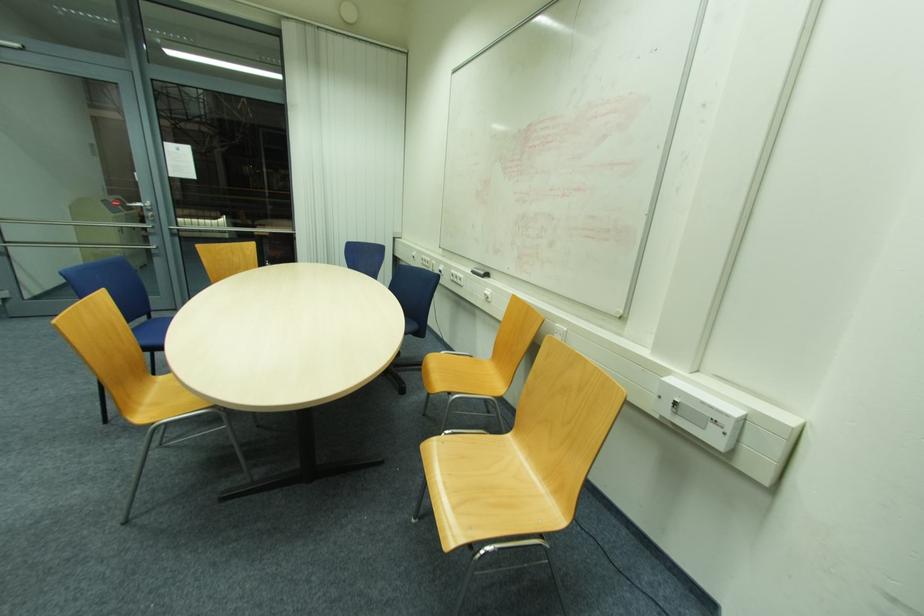
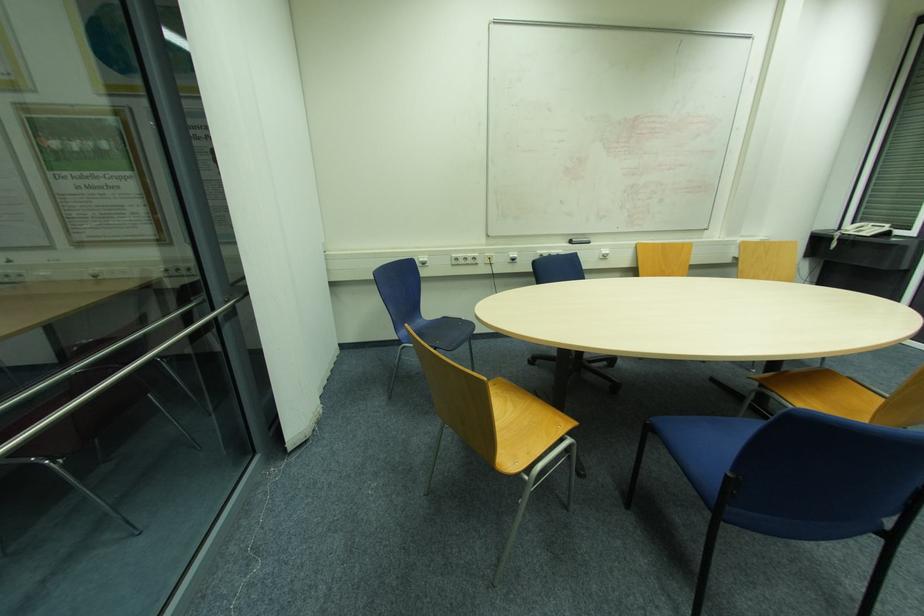
In the second image, find the point that corresponds to [488,293] in the first image.

(604, 253)